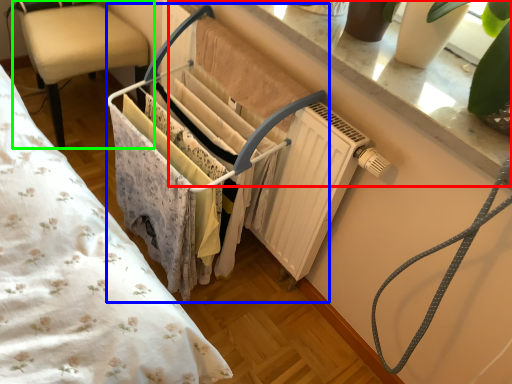
Question: Based on their relative distances, which object is farther from window sill (highlighted by a red box)? Choose from closet (highlighted by a blue box) and chair (highlighted by a green box).

Choices:
 (A) closet
 (B) chair

Answer: (B)